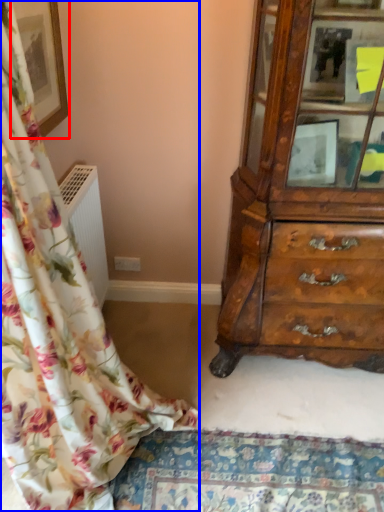
Question: Which of the following is the farthest to the observer, picture frame (highlighted by a red box) or curtain (highlighted by a blue box)?

Choices:
 (A) picture frame
 (B) curtain

Answer: (A)